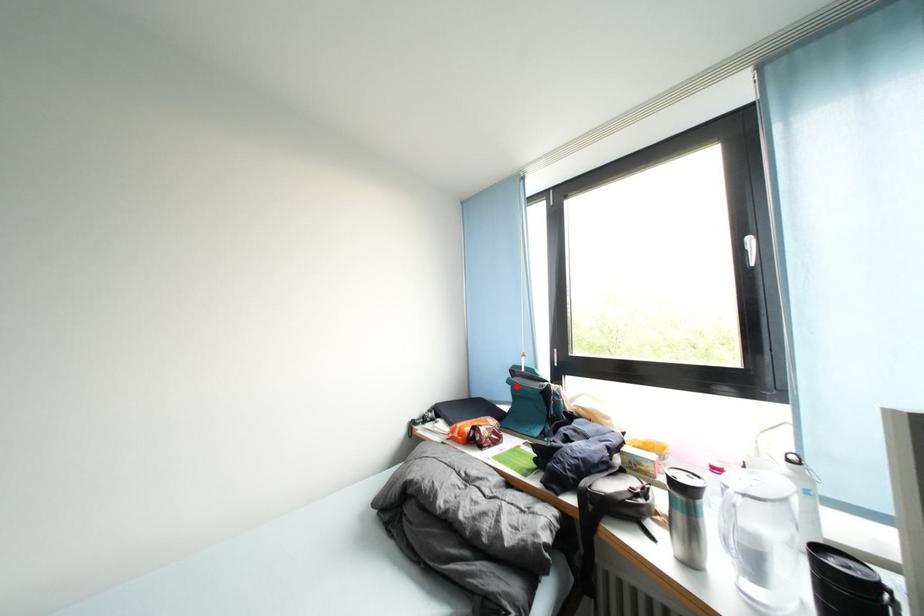
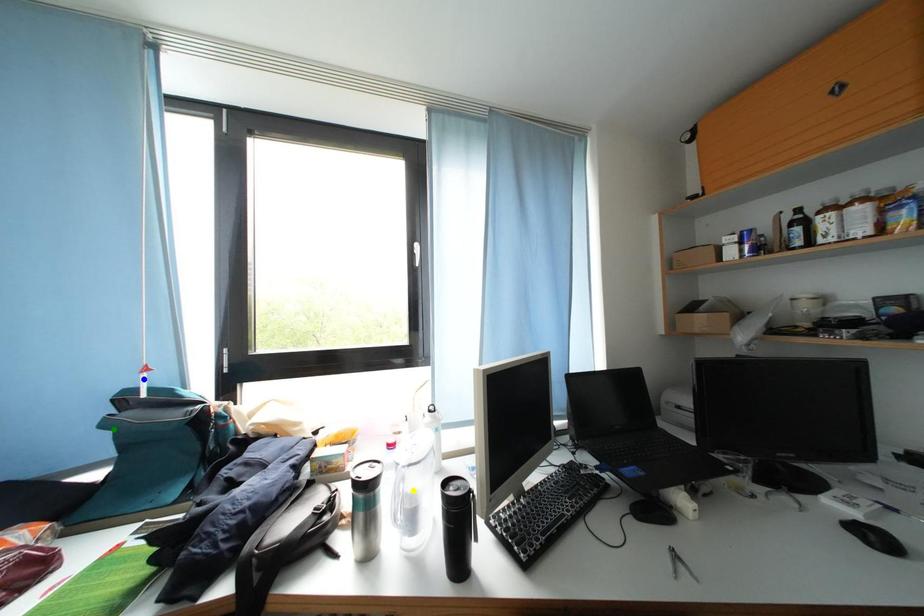
Question: I am providing you with two images of the same scene from different viewpoints. A red point is marked on the first image. You are given multiple points on the second image. In image 2, which mark is for the same physical point as the one in image 1?

Choices:
 (A) yellow point
 (B) green point
 (C) blue point

Answer: (B)